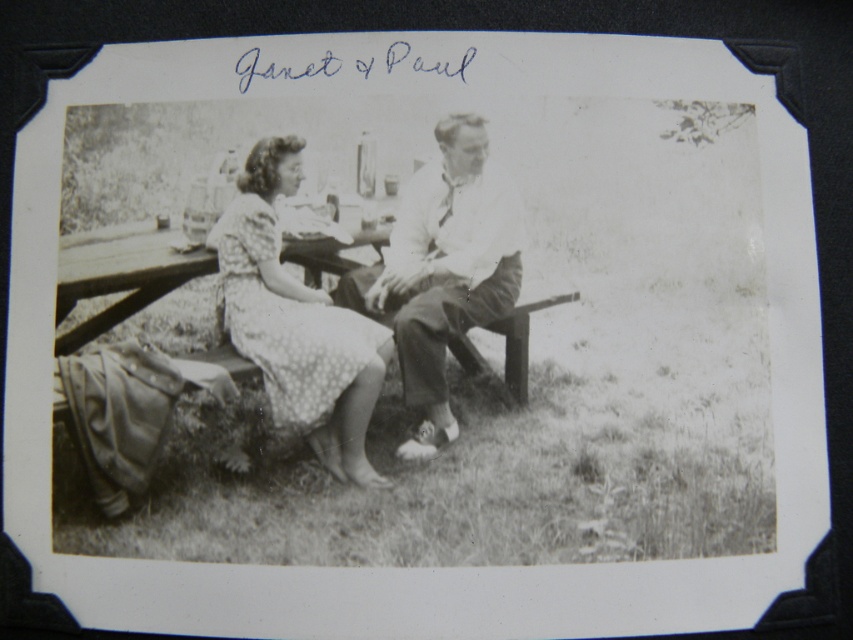
You are a photographer who wants to take a photo of the smooth white shirt at center and the camera. How far apart are they?

The smooth white shirt at center and camera are 6.80 feet apart from each other.